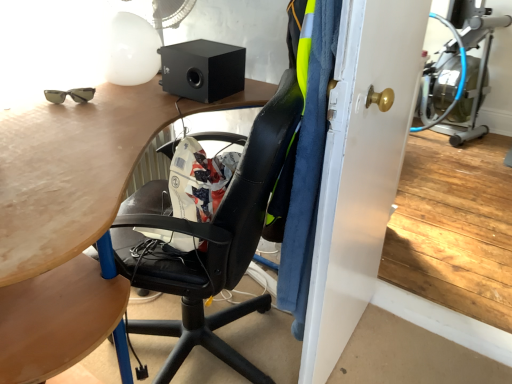
Question: From a real-world perspective, is black matte speaker at upper center under matte wood desk at center?

Choices:
 (A) yes
 (B) no

Answer: (B)

Question: Considering the relative sizes of black matte speaker at upper center and matte wood desk at center in the image provided, is black matte speaker at upper center bigger than matte wood desk at center?

Choices:
 (A) no
 (B) yes

Answer: (A)

Question: Does black matte speaker at upper center have a lesser width compared to matte wood desk at center?

Choices:
 (A) no
 (B) yes

Answer: (B)

Question: Is black matte speaker at upper center further to camera compared to matte wood desk at center?

Choices:
 (A) yes
 (B) no

Answer: (A)

Question: From the image's perspective, is black matte speaker at upper center beneath matte wood desk at center?

Choices:
 (A) no
 (B) yes

Answer: (A)

Question: Visually, is black matte speaker at upper center positioned to the left or to the right of matte gold door handle at center?

Choices:
 (A) right
 (B) left

Answer: (B)

Question: Considering the positions of black matte speaker at upper center and matte gold door handle at center in the image, is black matte speaker at upper center bigger or smaller than matte gold door handle at center?

Choices:
 (A) big
 (B) small

Answer: (B)

Question: Considering the positions of black matte speaker at upper center and matte gold door handle at center in the image, is black matte speaker at upper center taller or shorter than matte gold door handle at center?

Choices:
 (A) short
 (B) tall

Answer: (A)

Question: Considering the positions of point (217, 77) and point (309, 367), is point (217, 77) closer or farther from the camera than point (309, 367)?

Choices:
 (A) closer
 (B) farther

Answer: (B)

Question: From their relative heights in the image, would you say white plastic mechanical fan at upper center is taller or shorter than matte gold door handle at center?

Choices:
 (A) tall
 (B) short

Answer: (B)

Question: Considering the positions of white plastic mechanical fan at upper center and matte gold door handle at center in the image, is white plastic mechanical fan at upper center wider or thinner than matte gold door handle at center?

Choices:
 (A) thin
 (B) wide

Answer: (B)

Question: Would you say white plastic mechanical fan at upper center is inside or outside matte gold door handle at center?

Choices:
 (A) outside
 (B) inside

Answer: (A)

Question: In the image, is white plastic mechanical fan at upper center positioned in front of or behind matte gold door handle at center?

Choices:
 (A) front
 (B) behind

Answer: (B)

Question: Does point (134, 87) appear closer or farther from the camera than point (222, 59)?

Choices:
 (A) closer
 (B) farther

Answer: (B)

Question: From a real-world perspective, is matte wood desk at center physically located above or below black matte speaker at upper center?

Choices:
 (A) above
 (B) below

Answer: (B)